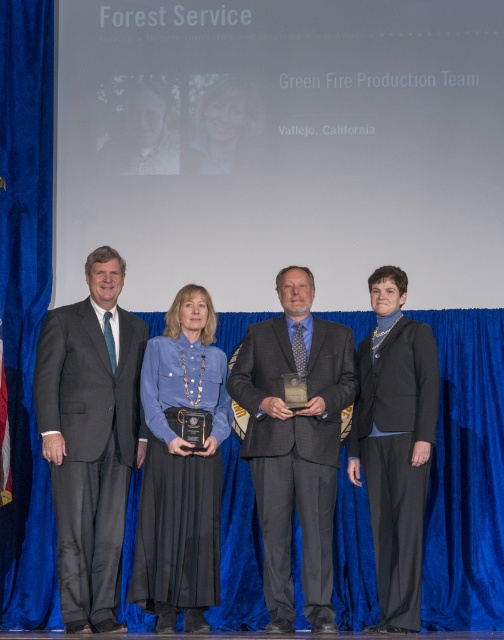
Between dark gray suit at center and blue satin blouse at center, which one appears on the right side from the viewer's perspective?

blue satin blouse at center is more to the right.

In the scene shown: Who is positioned more to the left, dark gray suit at center or blue satin blouse at center?

From the viewer's perspective, dark gray suit at center appears more on the left side.

Is point (43, 394) closer to camera compared to point (203, 531)?

Yes, it is in front of point (203, 531).

You are a GUI agent. You are given a task and a screenshot of the screen. Output one action in this format:
    pyautogui.click(x=<x>, y=<y>)
    Task: Click on the dark gray suit at center
    Image resolution: width=504 pixels, height=640 pixels.
    Given the screenshot: What is the action you would take?
    pyautogui.click(x=91, y=436)

Between point (76, 572) and point (256, 131), which one is positioned in front?

Positioned in front is point (76, 572).

Does dark gray suit at center have a smaller size compared to matte black hair at center?

Incorrect, dark gray suit at center is not smaller in size than matte black hair at center.

Is point (118, 371) positioned behind point (200, 102)?

No, it is not.

This screenshot has width=504, height=640. I want to click on dark gray suit at center, so click(91, 436).

Can you confirm if blue satin blouse at center is taller than matte black hair at center?

Yes, blue satin blouse at center is taller than matte black hair at center.

Is blue satin blouse at center smaller than matte black hair at center?

No, blue satin blouse at center is not smaller than matte black hair at center.

Identify the location of blue satin blouse at center. The image size is (504, 640). [x=180, y=468].

Where is `blue satin blouse at center`? The image size is (504, 640). blue satin blouse at center is located at coordinates (180, 468).